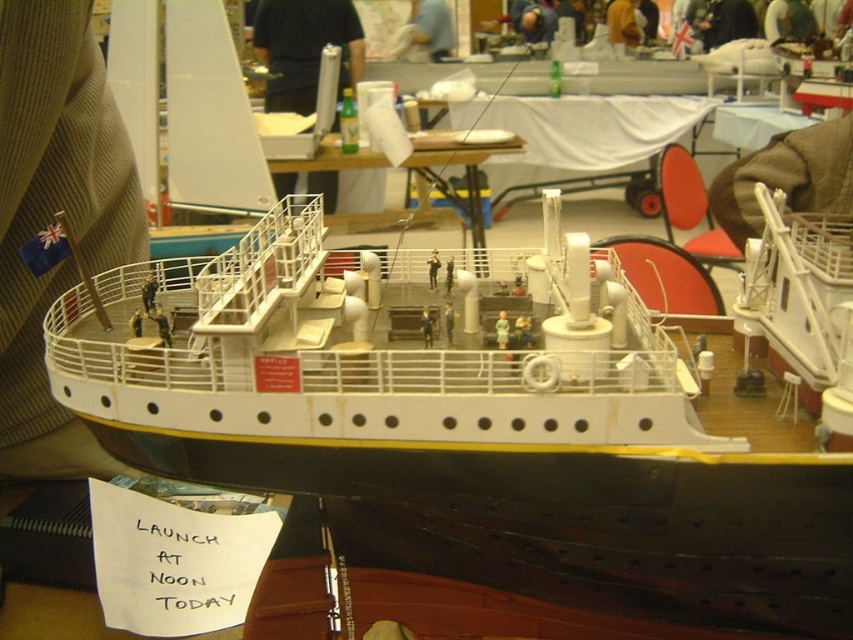
Question: Can you confirm if white plastic ship at center is smaller than white fabric table at center?

Choices:
 (A) no
 (B) yes

Answer: (A)

Question: Is white plastic ship at center above white plastic table at center?

Choices:
 (A) no
 (B) yes

Answer: (A)

Question: Which point is farther to the camera?

Choices:
 (A) (548, 122)
 (B) (363, 499)

Answer: (A)

Question: Which object is closer to the camera taking this photo?

Choices:
 (A) white plastic ship at center
 (B) white fabric table at center
 (C) white plastic table at center

Answer: (A)

Question: Which is nearer to the white plastic ship at center?

Choices:
 (A) white fabric table at center
 (B) white plastic table at center

Answer: (B)

Question: Is white plastic ship at center in front of white fabric table at center?

Choices:
 (A) yes
 (B) no

Answer: (A)